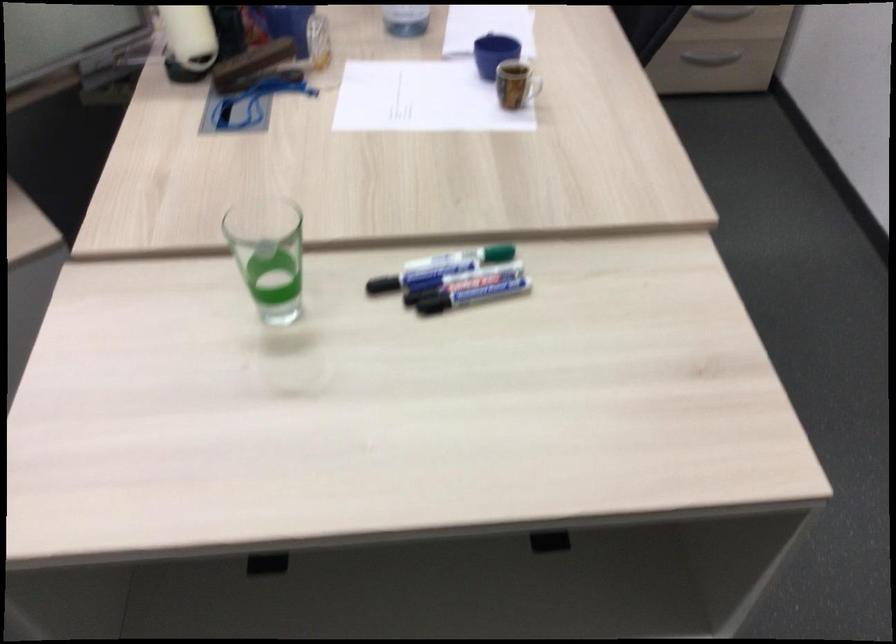
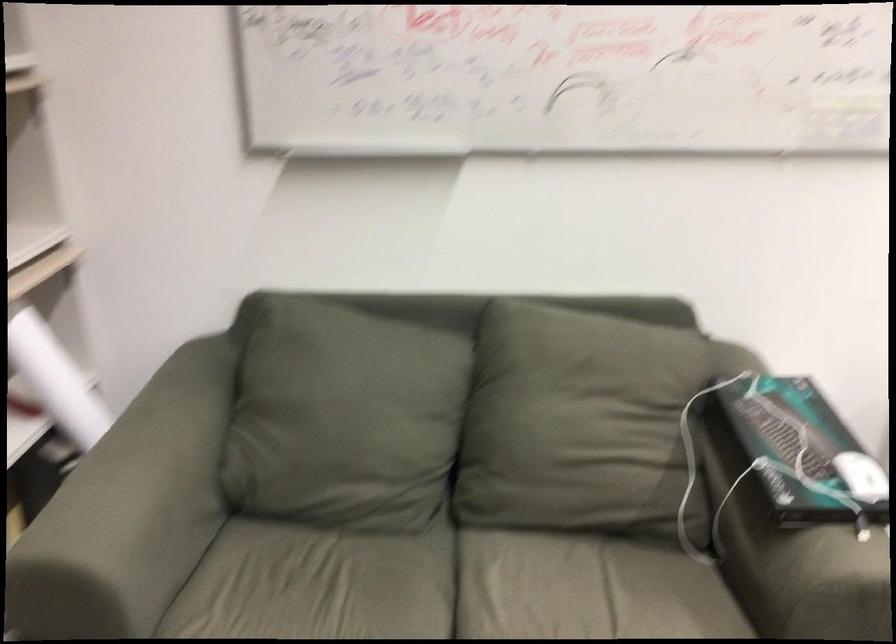
The images are taken continuously from a first-person perspective. In which direction is your viewpoint rotating?

The rotation direction of the camera is left-down.